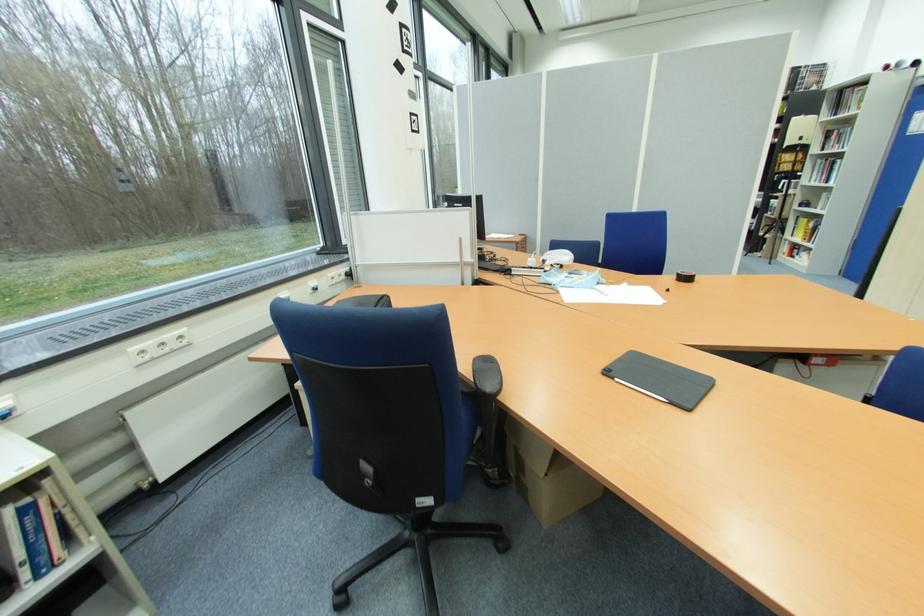
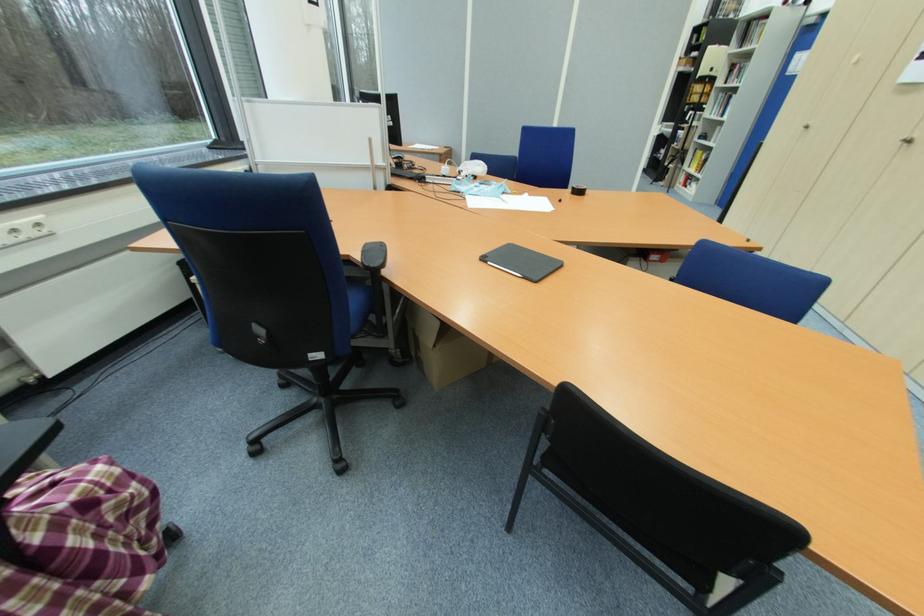
The point at (622,381) is marked in the first image. Where is the corresponding point in the second image?

(492, 264)